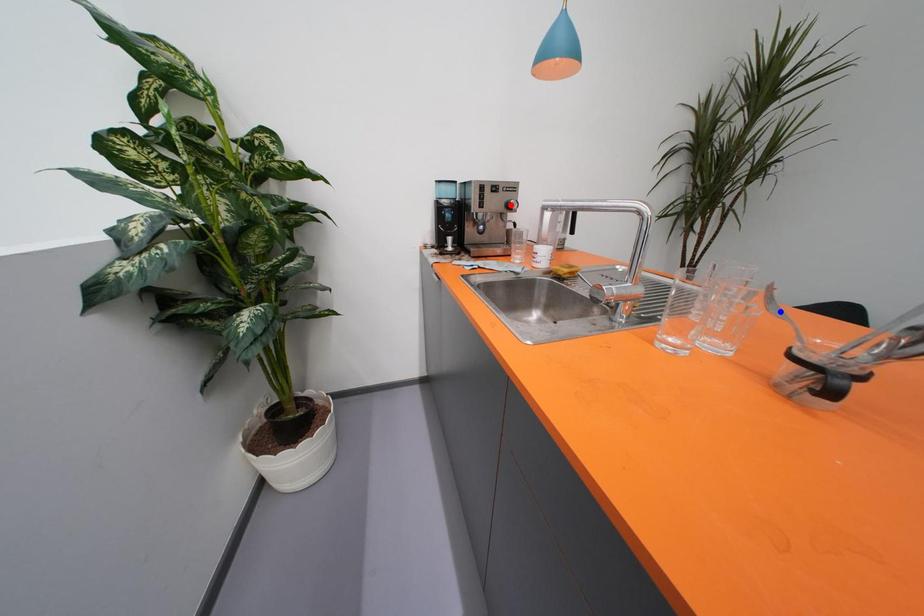
Question: Two points are marked on the image. Which point is closer to the camera?

Choices:
 (A) Blue point is closer.
 (B) Red point is closer.

Answer: (A)